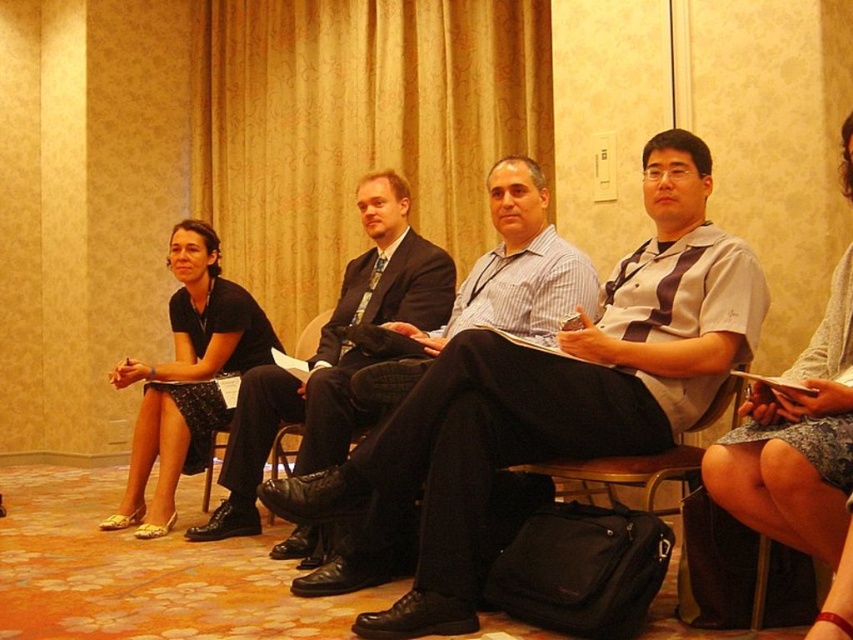
You are a GUI agent. You are given a task and a screenshot of the screen. Output one action in this format:
    pyautogui.click(x=<x>, y=<y>)
    Task: Click on the matte black suit at center
    
    Given the screenshot: What is the action you would take?
    [332, 355]

Which is behind, point (375, 285) or point (843, 611)?

Point (375, 285)

At what (x,y) coordinates should I click in order to perform the action: click on matte black suit at center. Please return your answer as a coordinate pair (x, y). The image size is (853, 640). Looking at the image, I should click on (332, 355).

Does brown leather chair at center appear on the right side of black leather chair at center?

Indeed, brown leather chair at center is positioned on the right side of black leather chair at center.

Is brown leather chair at center smaller than black leather chair at center?

No.

Describe the element at coordinates (624, 472) in the screenshot. I see `brown leather chair at center` at that location.

Identify the location of brown leather chair at center. (624, 472).

Is matte black suit at center bigger than black fabric skirt at left?

Yes, matte black suit at center is bigger than black fabric skirt at left.

Who is taller, matte black suit at center or black fabric skirt at left?

Standing taller between the two is matte black suit at center.

Between point (242, 449) and point (195, 227), which one is positioned in front?

Positioned in front is point (242, 449).

Locate an element on the screen. matte black suit at center is located at coordinates (332, 355).